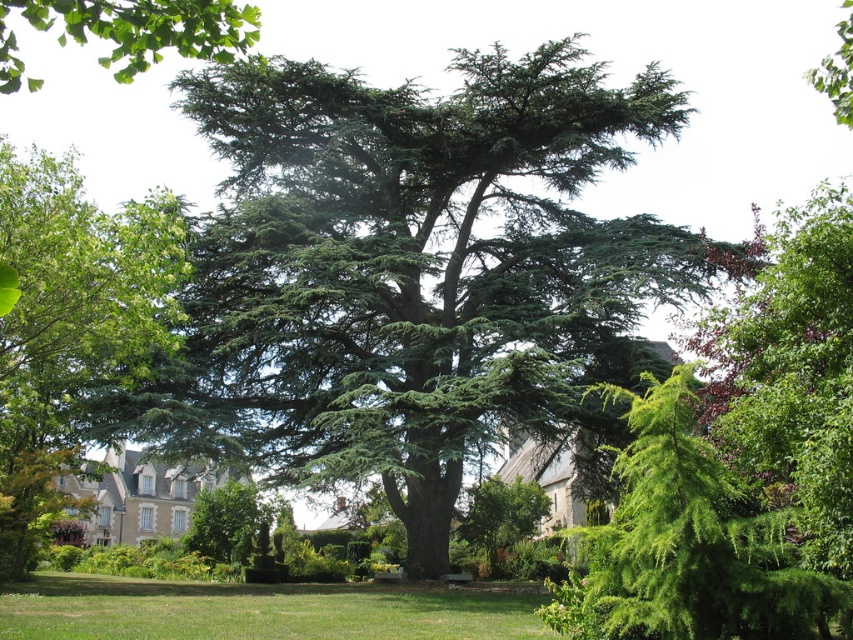
Does point (479, 500) come behind point (247, 484)?

No, (479, 500) is closer to viewer.

Is green leafy tree at center positioned in front of green textured tree at center?

Yes, it is in front of green textured tree at center.

Is point (473, 502) less distant than point (228, 500)?

Yes, point (473, 502) is closer to viewer.

At what (x,y) coordinates should I click in order to perform the action: click on green leafy tree at center. Please return your answer as a coordinate pair (x, y). The image size is (853, 640). Looking at the image, I should click on (500, 516).

Is green leafy tree at left above green grass at lower center?

Indeed, green leafy tree at left is positioned over green grass at lower center.

Is green leafy tree at left closer to the viewer compared to green grass at lower center?

Yes, green leafy tree at left is in front of green grass at lower center.

What do you see at coordinates (71, 326) in the screenshot?
I see `green leafy tree at left` at bounding box center [71, 326].

Identify the location of green leafy tree at left. Image resolution: width=853 pixels, height=640 pixels. (71, 326).

Based on the photo, does green needle-like tree at center have a larger size compared to green textured tree at center?

Yes.

Can you confirm if green needle-like tree at center is positioned to the left of green textured tree at center?

In fact, green needle-like tree at center is to the right of green textured tree at center.

Measure the distance between point (x=399, y=449) and camera.

Point (x=399, y=449) and camera are 85.35 meters apart.

Where is `green needle-like tree at center`? green needle-like tree at center is located at coordinates (410, 273).